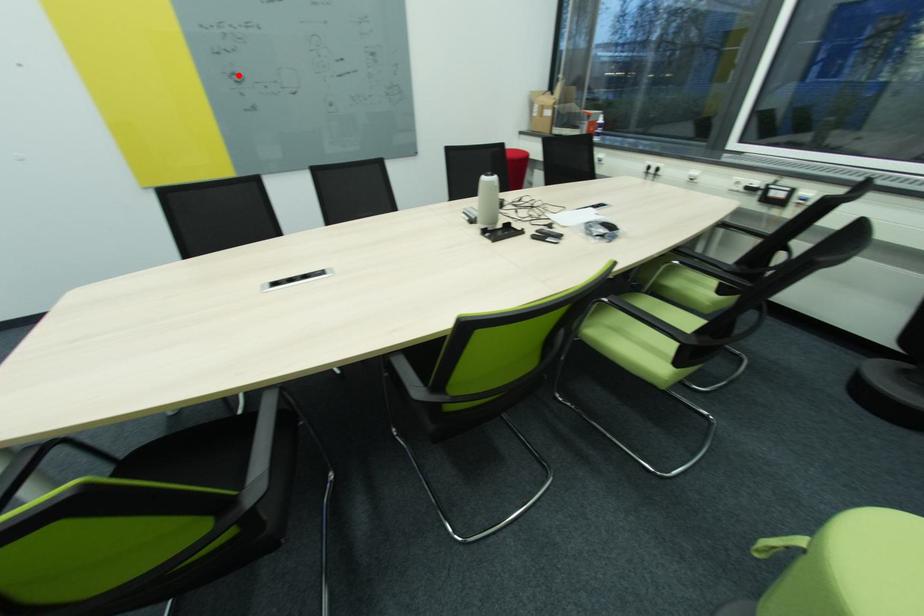
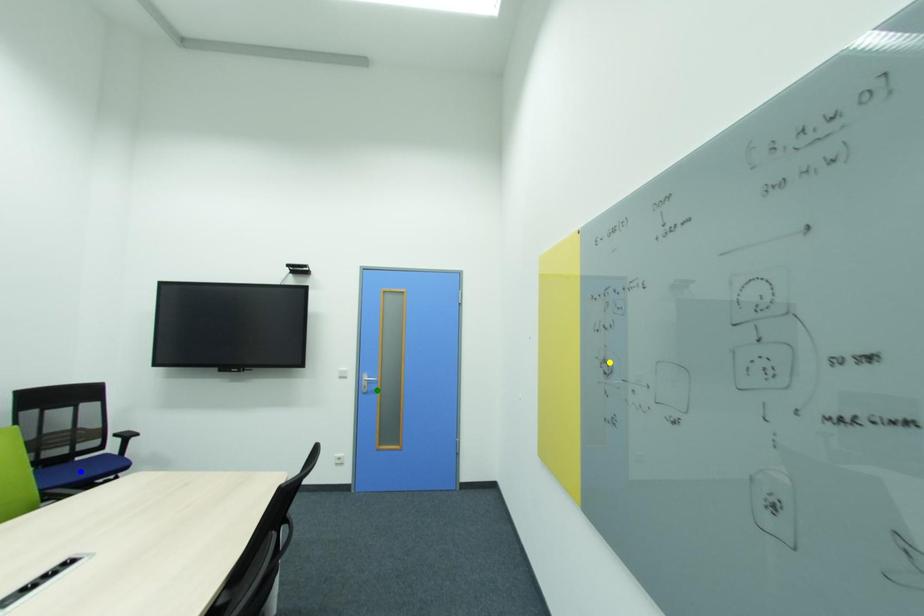
Question: I am providing you with two images of the same scene from different viewpoints. A red point is marked on the first image. You are given multiple points on the second image. Which point in image 2 represents the same 3d spot as the red point in image 1?

Choices:
 (A) yellow point
 (B) green point
 (C) blue point

Answer: (A)